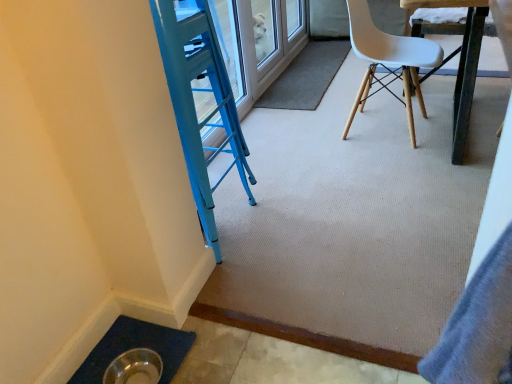
Question: Does metallic dark brown table at upper right lie behind carpet at center?

Choices:
 (A) yes
 (B) no

Answer: (B)

Question: Is metallic dark brown table at upper right aimed at carpet at center?

Choices:
 (A) no
 (B) yes

Answer: (A)

Question: Is metallic dark brown table at upper right at the left side of carpet at center?

Choices:
 (A) no
 (B) yes

Answer: (A)

Question: Is metallic dark brown table at upper right turned away from carpet at center?

Choices:
 (A) yes
 (B) no

Answer: (B)

Question: From the image's perspective, is metallic dark brown table at upper right above carpet at center?

Choices:
 (A) no
 (B) yes

Answer: (A)

Question: Is white plastic chair at upper right inside the boundaries of metallic dark brown table at upper right, or outside?

Choices:
 (A) inside
 (B) outside

Answer: (A)

Question: Is white plastic chair at upper right taller or shorter than metallic dark brown table at upper right?

Choices:
 (A) short
 (B) tall

Answer: (A)

Question: From the image's perspective, is white plastic chair at upper right positioned above or below metallic dark brown table at upper right?

Choices:
 (A) below
 (B) above

Answer: (A)

Question: Is white plastic chair at upper right in front of or behind metallic dark brown table at upper right in the image?

Choices:
 (A) front
 (B) behind

Answer: (B)

Question: From a real-world perspective, is metallic dark brown table at upper right physically located above or below carpet at center?

Choices:
 (A) above
 (B) below

Answer: (A)

Question: Considering their positions, is metallic dark brown table at upper right located in front of or behind carpet at center?

Choices:
 (A) behind
 (B) front

Answer: (B)

Question: Looking at their shapes, would you say metallic dark brown table at upper right is wider or thinner than carpet at center?

Choices:
 (A) wide
 (B) thin

Answer: (A)

Question: Is point (476, 54) closer or farther from the camera than point (328, 82)?

Choices:
 (A) farther
 (B) closer

Answer: (B)

Question: Considering the positions of point (384, 34) and point (253, 107), is point (384, 34) closer or farther from the camera than point (253, 107)?

Choices:
 (A) farther
 (B) closer

Answer: (B)

Question: Based on their positions, is white plastic chair at upper right located to the left or right of carpet at center?

Choices:
 (A) right
 (B) left

Answer: (A)